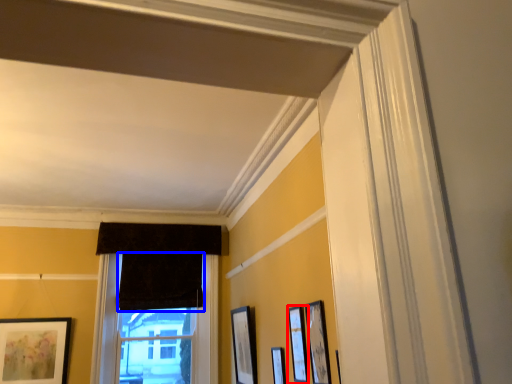
Question: Among these objects, which one is nearest to the camera, picture frame (highlighted by a red box) or curtain (highlighted by a blue box)?

Choices:
 (A) picture frame
 (B) curtain

Answer: (A)